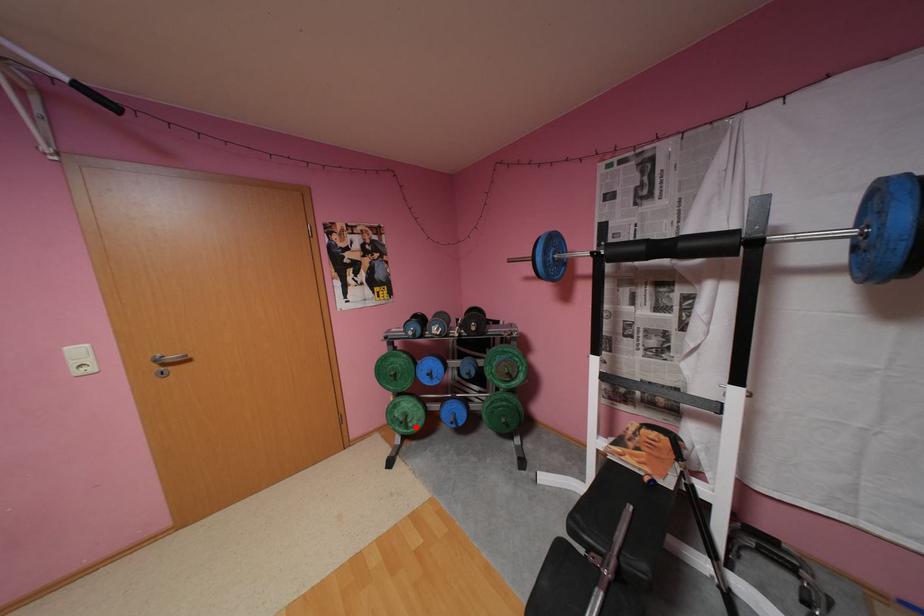
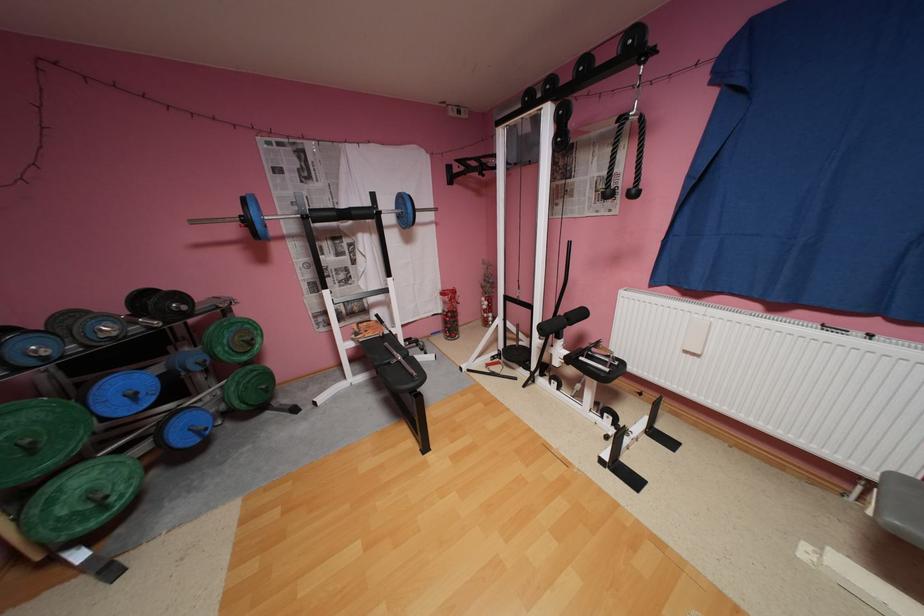
Question: A red point is marked in image1. In image2, is the corresponding 3D point closer to the camera or farther? Reply with the corresponding letter.

Choices:
 (A) The corresponding 3D point is closer.
 (B) The corresponding 3D point is farther.

Answer: (A)